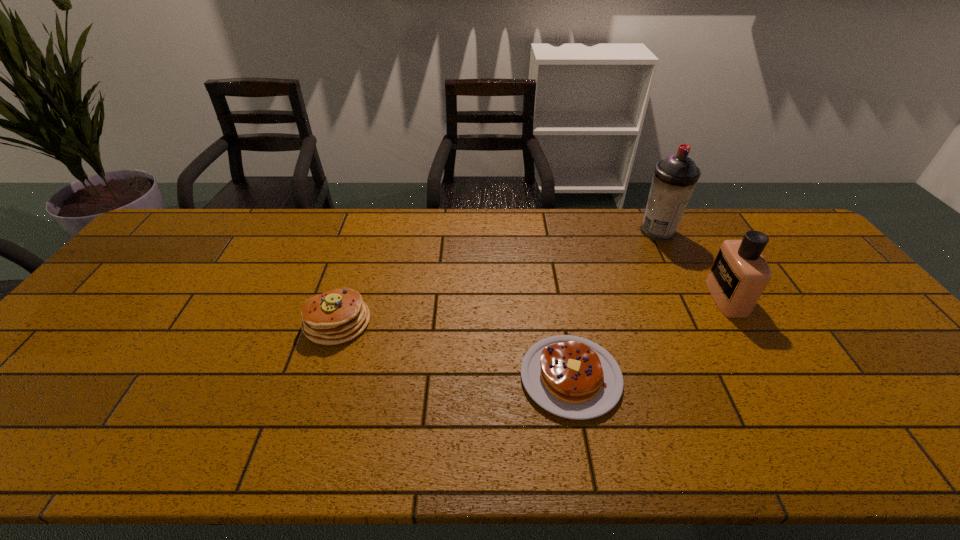
Where is `aerosol can`? The width and height of the screenshot is (960, 540). aerosol can is located at coordinates (675, 177).

In order to click on the tallest object in this screenshot , I will do `click(675, 177)`.

Locate an element on the screen. Image resolution: width=960 pixels, height=540 pixels. the second tallest object is located at coordinates (739, 275).

You are a GUI agent. You are given a task and a screenshot of the screen. Output one action in this format:
    pyautogui.click(x=<x>, y=<y>)
    Task: Click on the third tallest object
    The image size is (960, 540).
    Given the screenshot: What is the action you would take?
    pyautogui.click(x=338, y=315)

I want to click on the leftmost object, so click(338, 315).

The width and height of the screenshot is (960, 540). Identify the location of the right pancake. (x=572, y=377).

Locate an element on the screen. The width and height of the screenshot is (960, 540). the shorter pancake is located at coordinates (572, 377).

At what (x,y) coordinates should I click in order to perform the action: click on vacant space located 0.250m on the left of the farthest object. Please return your answer as a coordinate pair (x, y). Looking at the image, I should click on (564, 232).

At what (x,y) coordinates should I click in order to perform the action: click on vacant area located 0.270m on the front label of the perfume. Please return your answer as a coordinate pair (x, y). Looking at the image, I should click on (617, 298).

I want to click on vacant space situated on the front label of the perfume, so click(599, 298).